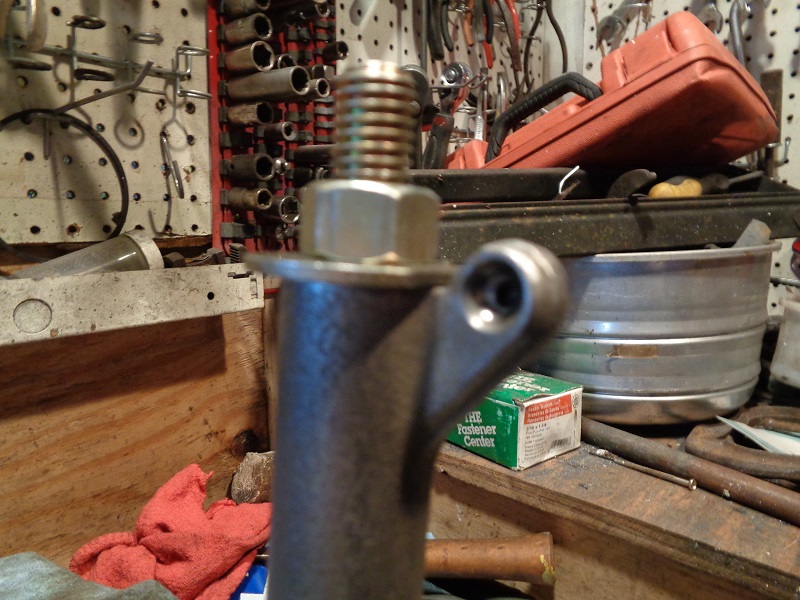
Where is `box`? Image resolution: width=800 pixels, height=600 pixels. box is located at coordinates click(670, 73).